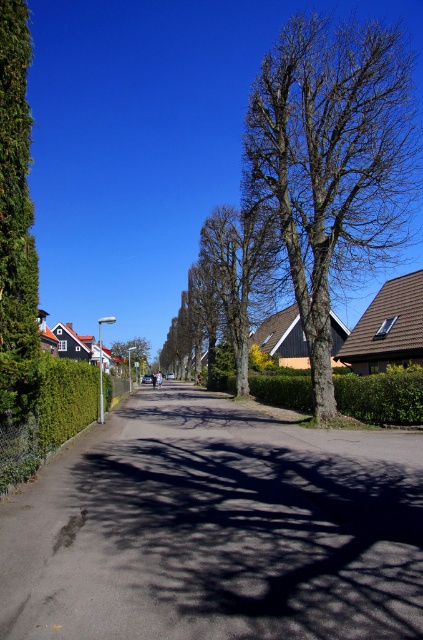
Question: Can you confirm if bare wood tree at center is positioned below white plastic street sign at center?

Choices:
 (A) no
 (B) yes

Answer: (A)

Question: Which point is closer to the camera?

Choices:
 (A) green hedge at left
 (B) bare wood tree at center

Answer: (A)

Question: Which point is farther from the camera taking this photo?

Choices:
 (A) (101, 355)
 (B) (181, 465)

Answer: (A)

Question: Can you confirm if green hedge at center is smaller than green textured hedge at left?

Choices:
 (A) yes
 (B) no

Answer: (B)

Question: Where is bare wood tree at center located in relation to green textured hedge at left in the image?

Choices:
 (A) above
 (B) below

Answer: (A)

Question: Among these objects, which one is farthest from the camera?

Choices:
 (A) green leafy tree at center
 (B) green hedge at left
 (C) green leafy hedge at center

Answer: (A)